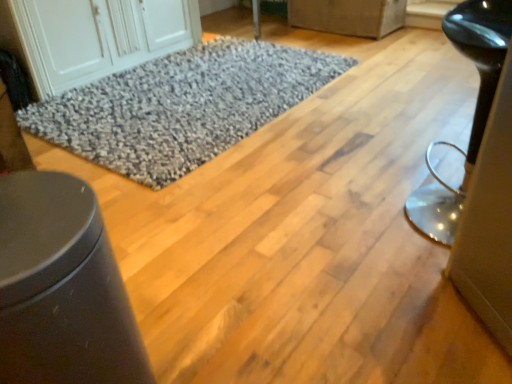
Question: Is white wood cabinet at upper left outside of gray shaggy rug at center?

Choices:
 (A) yes
 (B) no

Answer: (A)

Question: From a real-world perspective, is white wood cabinet at upper left positioned over gray shaggy rug at center based on gravity?

Choices:
 (A) yes
 (B) no

Answer: (A)

Question: Can you confirm if white wood cabinet at upper left is wider than gray shaggy rug at center?

Choices:
 (A) yes
 (B) no

Answer: (B)

Question: Is white wood cabinet at upper left looking in the opposite direction of gray shaggy rug at center?

Choices:
 (A) yes
 (B) no

Answer: (B)

Question: Does white wood cabinet at upper left have a lesser width compared to gray shaggy rug at center?

Choices:
 (A) yes
 (B) no

Answer: (A)

Question: In the image, is gray shaggy rug at center on the left side or the right side of glossy black stool at right, which appears as the 2th furniture when viewed from the back?

Choices:
 (A) right
 (B) left

Answer: (B)

Question: In the image, is gray shaggy rug at center positioned in front of or behind glossy black stool at right, which is counted as the second furniture, starting from the left?

Choices:
 (A) front
 (B) behind

Answer: (B)

Question: In terms of width, does gray shaggy rug at center look wider or thinner when compared to glossy black stool at right, which is counted as the second furniture, starting from the left?

Choices:
 (A) wide
 (B) thin

Answer: (A)

Question: Is point coord(273,74) closer or farther from the camera than point coord(495,36)?

Choices:
 (A) closer
 (B) farther

Answer: (B)

Question: From a real-world perspective, relative to matte gray fabric couch at upper center, marked as the 1th furniture in a right-to-left arrangement, is matte black trash can at lower left, which is the first furniture in front-to-back order, vertically above or below?

Choices:
 (A) above
 (B) below

Answer: (A)

Question: Considering the positions of point (28, 256) and point (356, 11), is point (28, 256) closer or farther from the camera than point (356, 11)?

Choices:
 (A) closer
 (B) farther

Answer: (A)

Question: From the image's perspective, is matte black trash can at lower left, which is the first furniture in front-to-back order, located above or below matte gray fabric couch at upper center, marked as the 1th furniture in a right-to-left arrangement?

Choices:
 (A) above
 (B) below

Answer: (B)

Question: Considering their positions, is matte black trash can at lower left, which is the 1th furniture from bottom to top, located in front of or behind matte gray fabric couch at upper center, placed as the 3th furniture when sorted from bottom to top?

Choices:
 (A) front
 (B) behind

Answer: (A)

Question: Looking at the image, does matte gray fabric couch at upper center, marked as the 1th furniture in a right-to-left arrangement, seem bigger or smaller compared to white wood cabinet at upper left?

Choices:
 (A) small
 (B) big

Answer: (A)

Question: Considering the positions of matte gray fabric couch at upper center, which ranks as the third furniture in front-to-back order, and white wood cabinet at upper left in the image, is matte gray fabric couch at upper center, which ranks as the third furniture in front-to-back order, taller or shorter than white wood cabinet at upper left?

Choices:
 (A) short
 (B) tall

Answer: (A)